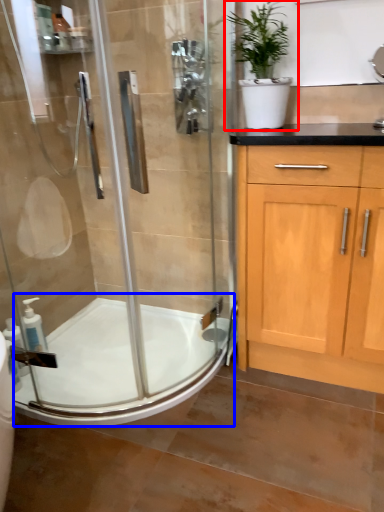
Question: Which of the following is the closest to the observer, houseplant (highlighted by a red box) or bath (highlighted by a blue box)?

Choices:
 (A) houseplant
 (B) bath

Answer: (A)